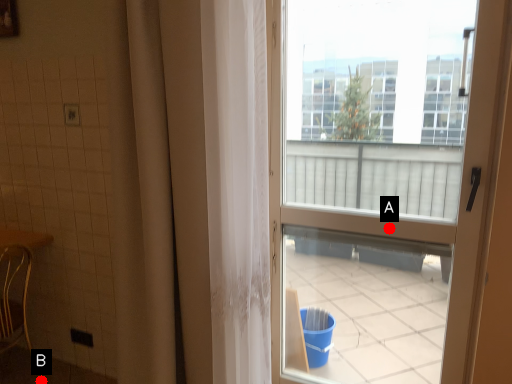
Question: Two points are circled on the image, labeled by A and B beside each circle. Which point is closer to the camera taking this photo?

Choices:
 (A) A is closer
 (B) B is closer

Answer: (A)